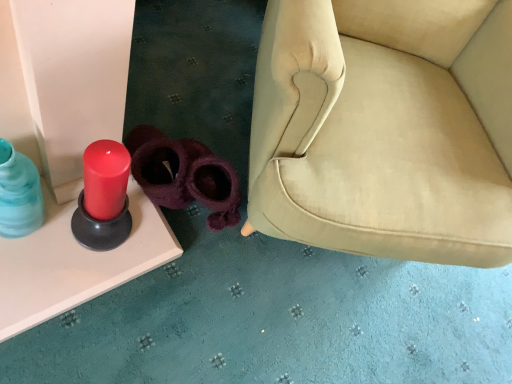
Question: Does purple fuzzy slippers at lower center, the second footwear from the left, have a lesser height compared to translucent blue glass bottle at left?

Choices:
 (A) no
 (B) yes

Answer: (B)

Question: From the image's perspective, is purple fuzzy slippers at lower center, the first footwear positioned from the right, located above translucent blue glass bottle at left?

Choices:
 (A) no
 (B) yes

Answer: (B)

Question: Considering the relative sizes of purple fuzzy slippers at lower center, the second footwear from the left, and translucent blue glass bottle at left in the image provided, is purple fuzzy slippers at lower center, the second footwear from the left, thinner than translucent blue glass bottle at left?

Choices:
 (A) no
 (B) yes

Answer: (A)

Question: Is purple fuzzy slippers at lower center, the first footwear positioned from the right, placed right next to translucent blue glass bottle at left?

Choices:
 (A) yes
 (B) no

Answer: (B)

Question: Can you confirm if purple fuzzy slippers at lower center, the first footwear positioned from the right, is bigger than translucent blue glass bottle at left?

Choices:
 (A) yes
 (B) no

Answer: (A)

Question: Which is correct: purple fuzzy slippers at lower center, the first footwear positioned from the right, is inside translucent blue glass bottle at left, or outside of it?

Choices:
 (A) outside
 (B) inside

Answer: (A)

Question: Considering the positions of purple fuzzy slippers at lower center, the second footwear from the left, and translucent blue glass bottle at left in the image, is purple fuzzy slippers at lower center, the second footwear from the left, taller or shorter than translucent blue glass bottle at left?

Choices:
 (A) tall
 (B) short

Answer: (B)

Question: Considering the positions of point (199, 196) and point (38, 215), is point (199, 196) closer or farther from the camera than point (38, 215)?

Choices:
 (A) closer
 (B) farther

Answer: (B)

Question: From the image's perspective, is purple fuzzy slippers at lower center, the first footwear positioned from the right, located above or below translucent blue glass bottle at left?

Choices:
 (A) below
 (B) above

Answer: (B)

Question: Which is correct: translucent blue glass bottle at left is inside purple fuzzy slippers at center, positioned as the first footwear in left-to-right order, or outside of it?

Choices:
 (A) inside
 (B) outside

Answer: (B)

Question: Considering the positions of point (4, 175) and point (165, 188), is point (4, 175) closer or farther from the camera than point (165, 188)?

Choices:
 (A) farther
 (B) closer

Answer: (B)

Question: In terms of width, does translucent blue glass bottle at left look wider or thinner when compared to purple fuzzy slippers at center, positioned as the first footwear in left-to-right order?

Choices:
 (A) thin
 (B) wide

Answer: (A)

Question: Is translucent blue glass bottle at left bigger or smaller than purple fuzzy slippers at center, positioned as the first footwear in left-to-right order?

Choices:
 (A) big
 (B) small

Answer: (B)

Question: Looking at their shapes, would you say purple fuzzy slippers at center, the 2th footwear when ordered from right to left, is wider or thinner than translucent blue glass bottle at left?

Choices:
 (A) wide
 (B) thin

Answer: (A)

Question: From a real-world perspective, relative to translucent blue glass bottle at left, is purple fuzzy slippers at center, the 2th footwear when ordered from right to left, vertically above or below?

Choices:
 (A) below
 (B) above

Answer: (A)